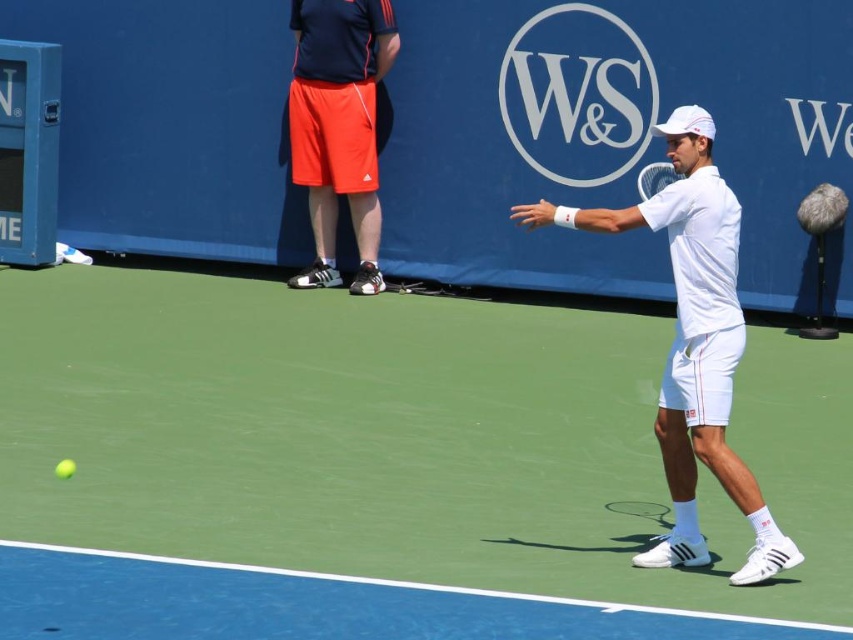
Question: Considering the real-world distances, which object is closest to the white matte tennis racket at center?

Choices:
 (A) green synthetic turf at center
 (B) yellow matte tennis ball at lower left
 (C) orange cotton shorts at upper left

Answer: (C)

Question: Is orange cotton shorts at upper left positioned at the back of yellow matte tennis ball at lower left?

Choices:
 (A) no
 (B) yes

Answer: (B)

Question: Which object is farther from the camera taking this photo?

Choices:
 (A) white matte tennis racket at right
 (B) yellow matte tennis ball at lower left
 (C) white matte tennis racket at center
 (D) green synthetic turf at center

Answer: (C)

Question: Can you confirm if white matte tennis racket at right is positioned to the right of yellow matte tennis ball at lower left?

Choices:
 (A) no
 (B) yes

Answer: (B)

Question: Can you confirm if white matte tennis racket at right is smaller than orange cotton shorts at upper left?

Choices:
 (A) no
 (B) yes

Answer: (A)

Question: Considering the real-world distances, which object is closest to the orange cotton shorts at upper left?

Choices:
 (A) green synthetic turf at center
 (B) white matte tennis racket at center
 (C) yellow matte tennis ball at lower left
 (D) white matte tennis racket at right

Answer: (B)